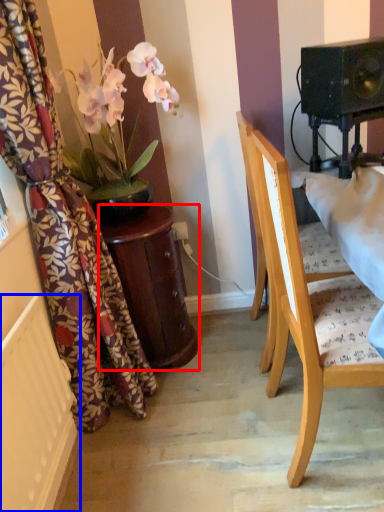
Question: Which of the following is the farthest to the observer, table (highlighted by a red box) or radiator (highlighted by a blue box)?

Choices:
 (A) table
 (B) radiator

Answer: (A)